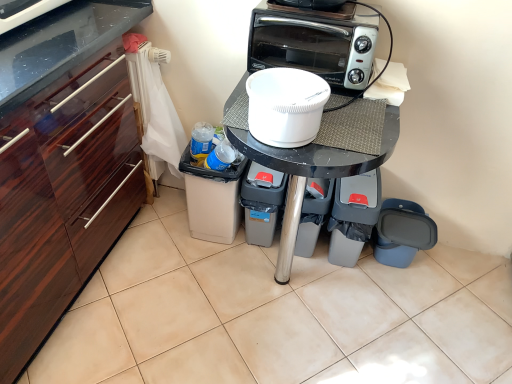
Question: Is gray plastic trash can at lower right, placed as the second appliance when sorted from right to left, at the back of silver metallic toaster oven at upper center?

Choices:
 (A) yes
 (B) no

Answer: (B)

Question: From a real-world perspective, does silver metallic toaster oven at upper center stand above gray plastic trash can at lower right, which ranks as the 3th appliance in left-to-right order?

Choices:
 (A) no
 (B) yes

Answer: (B)

Question: From the image's perspective, is silver metallic toaster oven at upper center under gray plastic trash can at lower right, placed as the second appliance when sorted from right to left?

Choices:
 (A) yes
 (B) no

Answer: (B)

Question: Is the position of silver metallic toaster oven at upper center more distant than that of gray plastic trash can at lower right, placed as the second appliance when sorted from right to left?

Choices:
 (A) no
 (B) yes

Answer: (A)

Question: Does silver metallic toaster oven at upper center lie in front of gray plastic trash can at lower right, which ranks as the 3th appliance in left-to-right order?

Choices:
 (A) no
 (B) yes

Answer: (B)

Question: Can gray plastic trash can at lower right, which ranks as the 3th appliance in left-to-right order, be found inside silver metallic toaster oven at upper center?

Choices:
 (A) yes
 (B) no

Answer: (B)

Question: From the image's perspective, is silver metallic toaster oven at upper center located above gray plastic trash bin at lower center, which is counted as the 4th appliance, starting from the right?

Choices:
 (A) yes
 (B) no

Answer: (A)

Question: Does silver metallic toaster oven at upper center appear on the left side of gray plastic trash bin at lower center, which is counted as the 4th appliance, starting from the right?

Choices:
 (A) yes
 (B) no

Answer: (B)

Question: Does silver metallic toaster oven at upper center have a lesser height compared to gray plastic trash bin at lower center, positioned as the first appliance in left-to-right order?

Choices:
 (A) yes
 (B) no

Answer: (A)

Question: Can you confirm if silver metallic toaster oven at upper center is wider than gray plastic trash bin at lower center, which is counted as the 4th appliance, starting from the right?

Choices:
 (A) no
 (B) yes

Answer: (A)

Question: Does silver metallic toaster oven at upper center appear on the right side of gray plastic trash bin at lower center, positioned as the first appliance in left-to-right order?

Choices:
 (A) yes
 (B) no

Answer: (A)

Question: From the image's perspective, is silver metallic toaster oven at upper center located beneath gray plastic trash bin at lower center, which is counted as the 4th appliance, starting from the right?

Choices:
 (A) yes
 (B) no

Answer: (B)

Question: Does gray plastic trash can at lower center, which is the 3th appliance in right-to-left order, have a greater width compared to white plastic container at center?

Choices:
 (A) yes
 (B) no

Answer: (A)